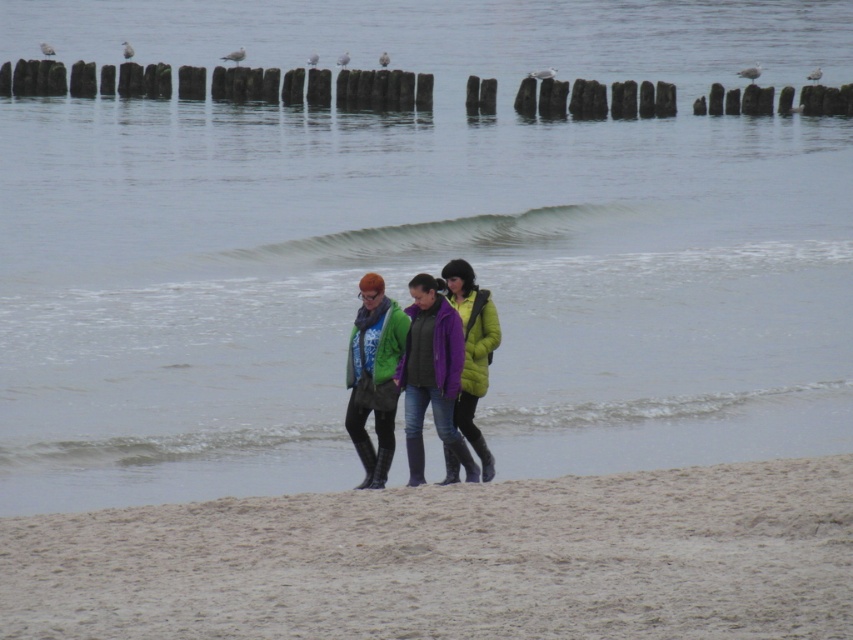
Question: Which point is closer to the camera?

Choices:
 (A) (447, 468)
 (B) (412, 515)
 (C) (283, 256)

Answer: (B)

Question: Can you confirm if fine-grained sand at lower center is bigger than matte green jacket at center?

Choices:
 (A) yes
 (B) no

Answer: (B)

Question: Is fine-grained sand at lower center wider than matte green jacket at center?

Choices:
 (A) no
 (B) yes

Answer: (B)

Question: Does smooth gray wave at center have a lesser width compared to matte green jacket at center?

Choices:
 (A) yes
 (B) no

Answer: (B)

Question: Which point is closer to the camera?

Choices:
 (A) smooth gray wave at center
 (B) matte green jacket at center

Answer: (B)

Question: Which of the following is the closest to the observer?

Choices:
 (A) matte green jacket at center
 (B) smooth gray wave at center
 (C) fine-grained sand at lower center
 (D) green matte jacket at center

Answer: (C)